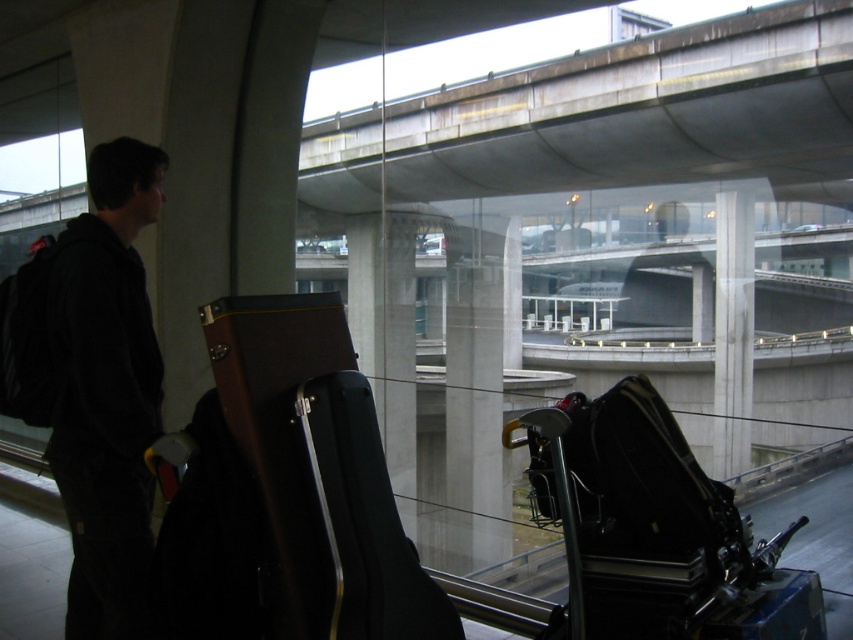
Question: Is brown leather guitar case at center wider than black hardshell suitcase at lower right?

Choices:
 (A) no
 (B) yes

Answer: (A)

Question: Estimate the real-world distances between objects in this image. Which object is farther from the dark gray hoodie at left?

Choices:
 (A) concrete overpass at upper center
 (B) brown leather guitar case at center
 (C) black hardshell suitcase at lower right

Answer: (A)

Question: Is the position of black hardshell suitcase at lower right less distant than that of dark gray hoodie at left?

Choices:
 (A) no
 (B) yes

Answer: (A)

Question: Among these points, which one is farthest from the camera?

Choices:
 (A) (566, 131)
 (B) (666, 538)
 (C) (73, 484)

Answer: (A)

Question: Considering the relative positions of brown leather guitar case at center and dark gray hoodie at left in the image provided, where is brown leather guitar case at center located with respect to dark gray hoodie at left?

Choices:
 (A) below
 (B) above

Answer: (A)

Question: Which point is farther to the camera?

Choices:
 (A) (53, 340)
 (B) (296, 497)
 (C) (712, 481)
 (D) (763, 156)

Answer: (C)